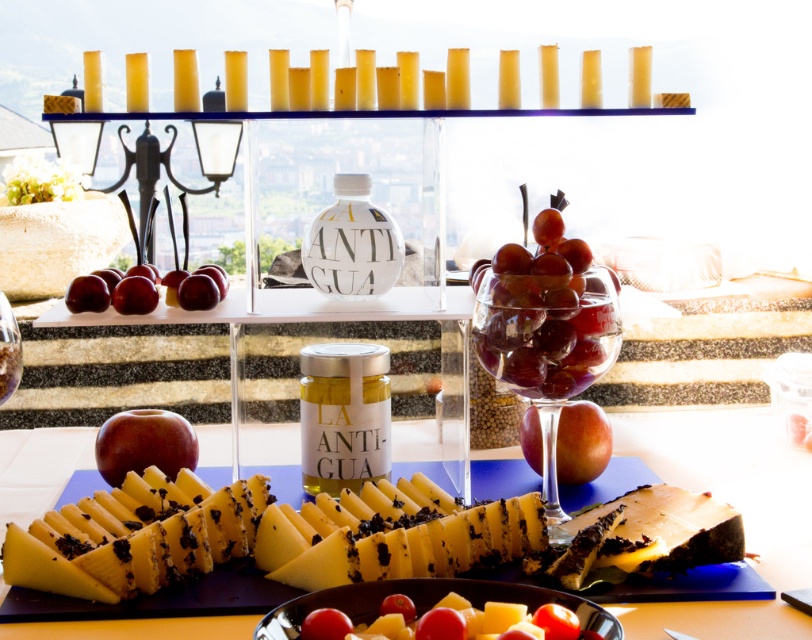
Question: Which of the following is the closest to the observer?

Choices:
 (A) red matte apple at lower left
 (B) glossy glass grapes at center
 (C) red matte apple at center
 (D) red glossy apples at center

Answer: (B)

Question: In this image, where is yellow cheese at center located relative to glossy glass grapes at center?

Choices:
 (A) below
 (B) above

Answer: (A)

Question: Is glossy glass grapes at center to the left of red glossy apples at center from the viewer's perspective?

Choices:
 (A) yes
 (B) no

Answer: (B)

Question: Estimate the real-world distances between objects in this image. Which object is farther from the translucent glass wine at lower left?

Choices:
 (A) red matte apple at lower left
 (B) transparent glass grapes at center
 (C) red matte apple at center
 (D) red glossy apples at center

Answer: (C)

Question: Is the position of red matte apple at center more distant than that of red glossy apples at center?

Choices:
 (A) yes
 (B) no

Answer: (A)

Question: Which is farther from the red matte apple at center?

Choices:
 (A) yellow cheese at center
 (B) glossy glass grapes at center
 (C) transparent glass grapes at center

Answer: (A)